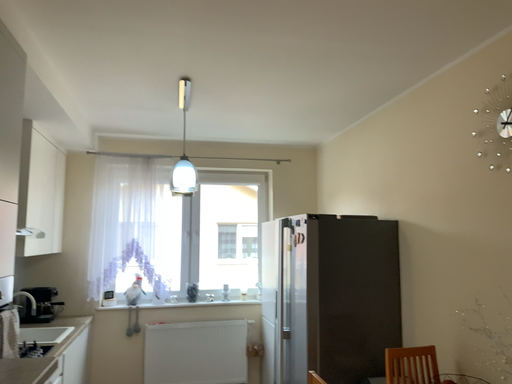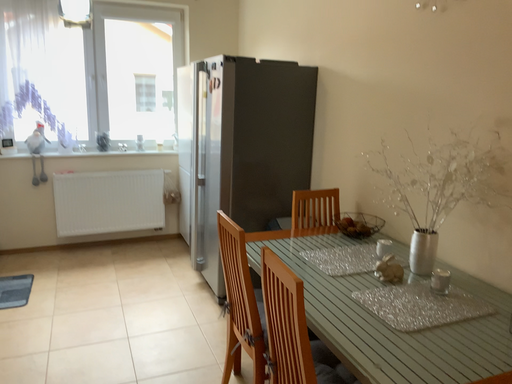
Question: Which way did the camera rotate in the video?

Choices:
 (A) rotated downward
 (B) rotated upward

Answer: (A)